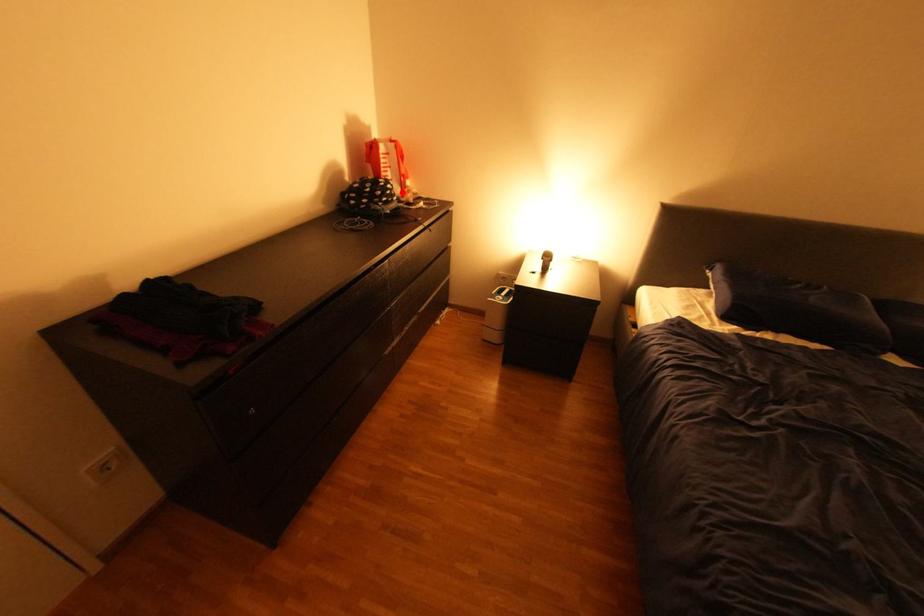
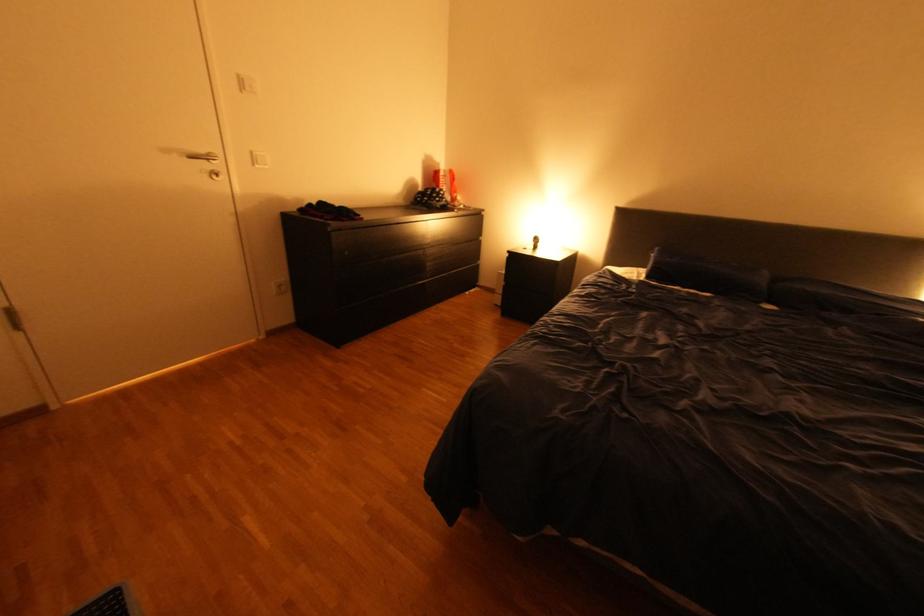
Locate, in the second image, the point that corresponds to the highlighted location in the first image.

(454, 196)